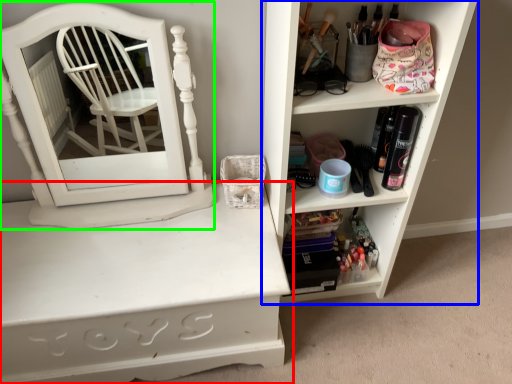
Question: Which object is positioned farthest from shelf (highlighted by a red box)? Select from shelf (highlighted by a blue box) and medicine cabinet (highlighted by a green box).

Choices:
 (A) shelf
 (B) medicine cabinet

Answer: (A)